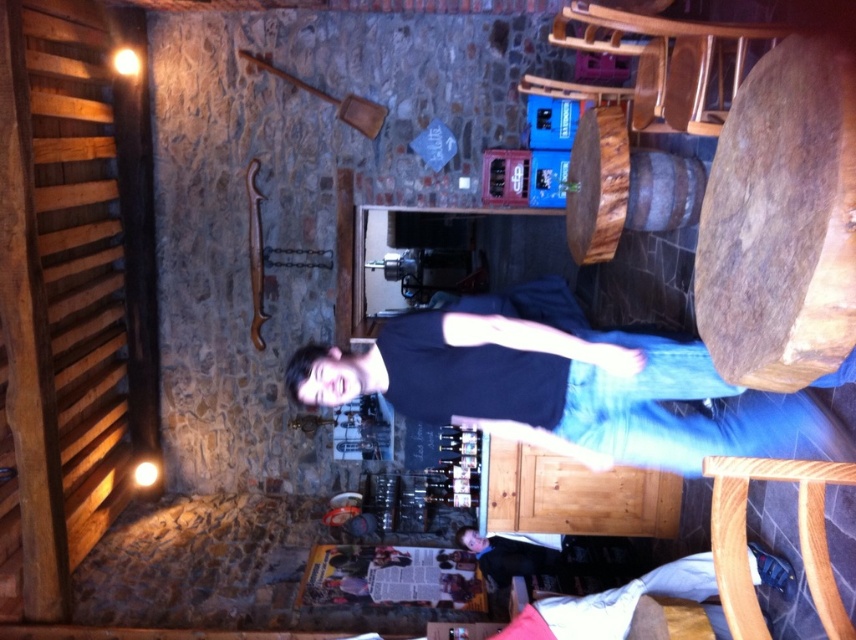
You are standing at the entrance of the rustic bar. You notice a point marked at coordinates [560,388]. What object is located at that point?

The point at [560,388] corresponds to the dark blue t shirt at center.